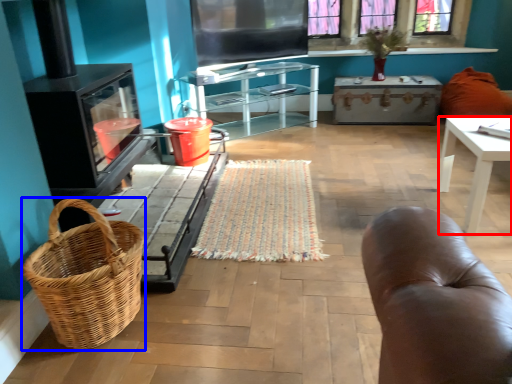
Question: Which of the following is the closest to the observer, desk (highlighted by a red box) or picnic basket (highlighted by a blue box)?

Choices:
 (A) desk
 (B) picnic basket

Answer: (B)